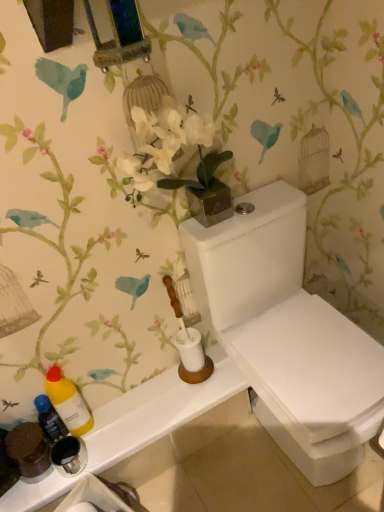
Question: Is translucent plastic bottle at lower left, which is counted as the second bottle, starting from the right, wider than white ceramic toilet brush at center?

Choices:
 (A) no
 (B) yes

Answer: (A)

Question: From the image's perspective, is translucent plastic bottle at lower left, positioned as the 1th bottle in left-to-right order, below white ceramic toilet brush at center?

Choices:
 (A) no
 (B) yes

Answer: (B)

Question: From a real-world perspective, is translucent plastic bottle at lower left, positioned as the 1th bottle in left-to-right order, over white ceramic toilet brush at center?

Choices:
 (A) yes
 (B) no

Answer: (B)

Question: Can you confirm if translucent plastic bottle at lower left, which is counted as the second bottle, starting from the right, is bigger than white ceramic toilet brush at center?

Choices:
 (A) yes
 (B) no

Answer: (B)

Question: Is there a large distance between translucent plastic bottle at lower left, positioned as the 1th bottle in left-to-right order, and white ceramic toilet brush at center?

Choices:
 (A) no
 (B) yes

Answer: (A)

Question: From a real-world perspective, is translucent plastic bottle at lower left, positioned as the 1th bottle in left-to-right order, located beneath white ceramic toilet brush at center?

Choices:
 (A) no
 (B) yes

Answer: (B)

Question: Is white glossy toilet at center looking in the opposite direction of white glossy counter top at lower left?

Choices:
 (A) no
 (B) yes

Answer: (A)

Question: Are white glossy toilet at center and white glossy counter top at lower left far apart?

Choices:
 (A) no
 (B) yes

Answer: (A)

Question: Is white glossy toilet at center smaller than white glossy counter top at lower left?

Choices:
 (A) yes
 (B) no

Answer: (B)

Question: From the image's perspective, is white glossy toilet at center on white glossy counter top at lower left?

Choices:
 (A) yes
 (B) no

Answer: (A)

Question: From a real-world perspective, is white glossy toilet at center on top of white glossy counter top at lower left?

Choices:
 (A) yes
 (B) no

Answer: (A)

Question: Is white glossy counter top at lower left located within white glossy toilet at center?

Choices:
 (A) no
 (B) yes

Answer: (A)

Question: Considering the relative positions of white ceramic toilet brush at center and translucent plastic bottle at lower left, which is counted as the second bottle, starting from the right, in the image provided, is white ceramic toilet brush at center to the left of translucent plastic bottle at lower left, which is counted as the second bottle, starting from the right, from the viewer's perspective?

Choices:
 (A) no
 (B) yes

Answer: (A)